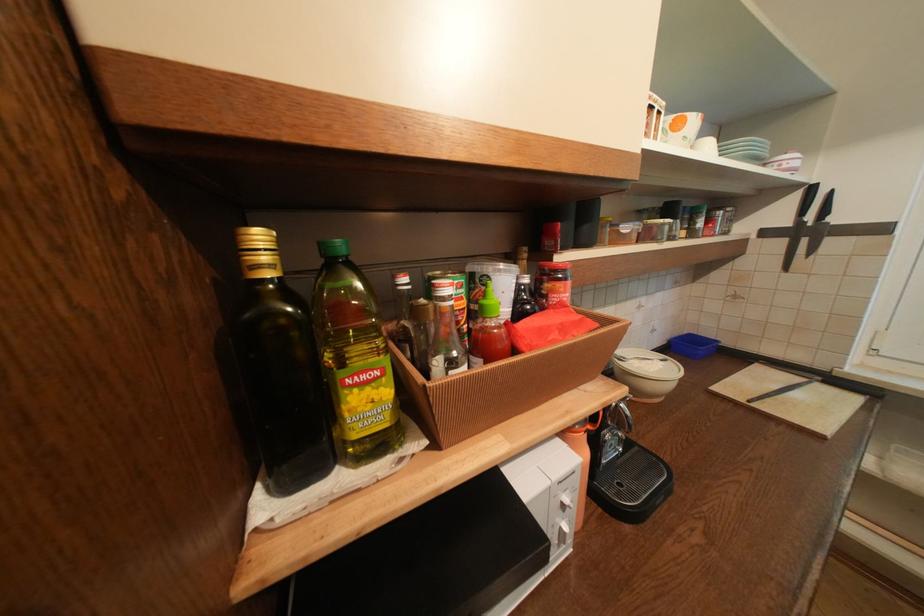
Find where to twist the red jar lid. Please return your answer as a coordinate pair (x, y).

(580, 458)